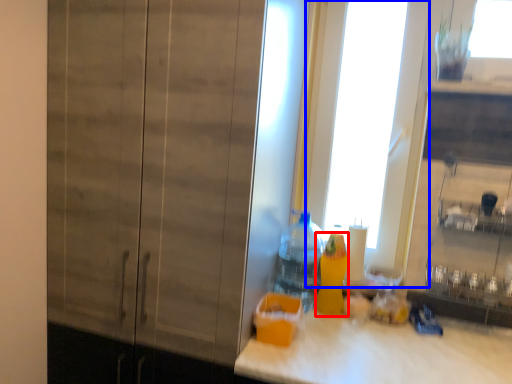
Question: Among these objects, which one is farthest to the camera, bottle (highlighted by a red box) or glass door (highlighted by a blue box)?

Choices:
 (A) bottle
 (B) glass door

Answer: (B)